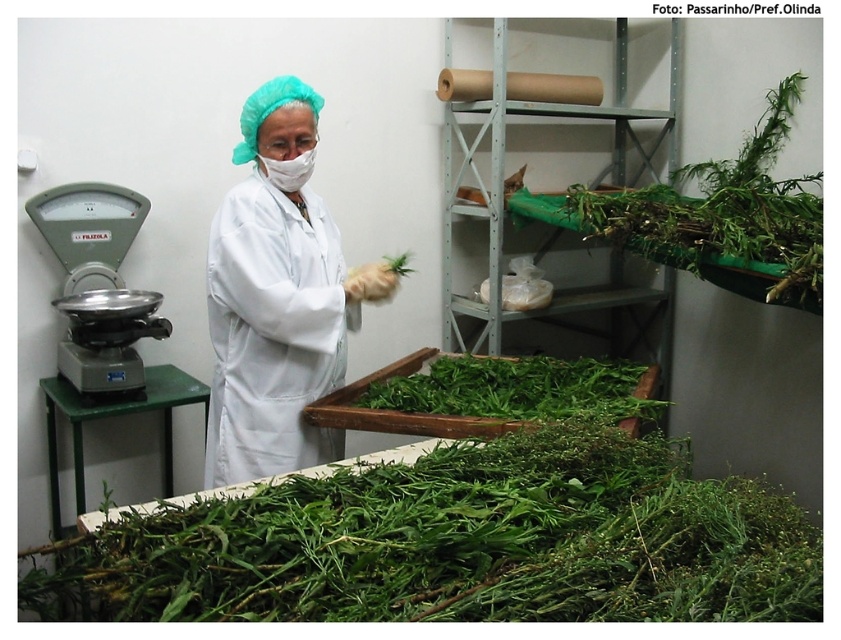
Between green leafy plant at upper right and green leafy at center, which one appears on the right side from the viewer's perspective?

From the viewer's perspective, green leafy plant at upper right appears more on the right side.

Can you confirm if green leafy plant at upper right is thinner than green leafy at center?

No.

Identify the location of green leafy plant at upper right. The height and width of the screenshot is (640, 841). (723, 212).

Can you confirm if white matte lab coat at center is smaller than green leafy plant at upper right?

Indeed, white matte lab coat at center has a smaller size compared to green leafy plant at upper right.

Does white matte lab coat at center come in front of green leafy plant at upper right?

That is True.

Locate an element on the screen. This screenshot has height=640, width=841. white matte lab coat at center is located at coordinates (278, 296).

Locate an element on the screen. This screenshot has height=640, width=841. white matte lab coat at center is located at coordinates (278, 296).

From the picture: Between white matte lab coat at center and green leafy at center, which one appears on the left side from the viewer's perspective?

Positioned to the left is white matte lab coat at center.

Where is `white matte lab coat at center`? The width and height of the screenshot is (841, 640). white matte lab coat at center is located at coordinates point(278,296).

You are a GUI agent. You are given a task and a screenshot of the screen. Output one action in this format:
    pyautogui.click(x=<x>, y=<y>)
    Task: Click on the white matte lab coat at center
    This screenshot has width=841, height=640.
    Given the screenshot: What is the action you would take?
    pyautogui.click(x=278, y=296)